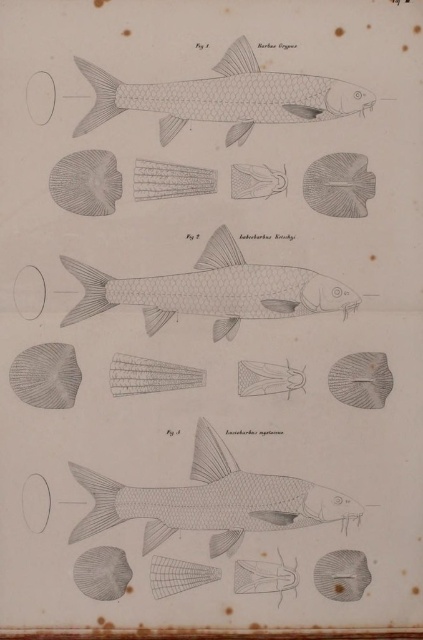
Based on the illustration, which fish is wider between the grayish silver fish at center and the gray textured fish at center?

The grayish silver fish at center is wider than the gray textured fish at center according to the illustration.

Consider the image. You are an underwater photographer holding a camera that can capture objects within 3 feet. You are looking at the grayish silver fish at center. Can you take a clear photo of it with your current position?

The grayish silver fish at center is 3.74 feet away from you, which is beyond your camera range of 3 feet. You need to move closer to capture it clearly.

You are an aquarium designer planning to place two fish tanks side by side in a narrow corridor. The corridor is only 16 inches wide. You have the grayish matte fish at upper center and the gray textured fish at center. Can both tanks fit side by side in the corridor without overlapping?

The distance between the grayish matte fish at upper center and the gray textured fish at center is 16.70 inches. Since the corridor is only 16 inches wide, the combined width of both tanks would exceed the available space. Therefore, they cannot fit side by side without overlapping.